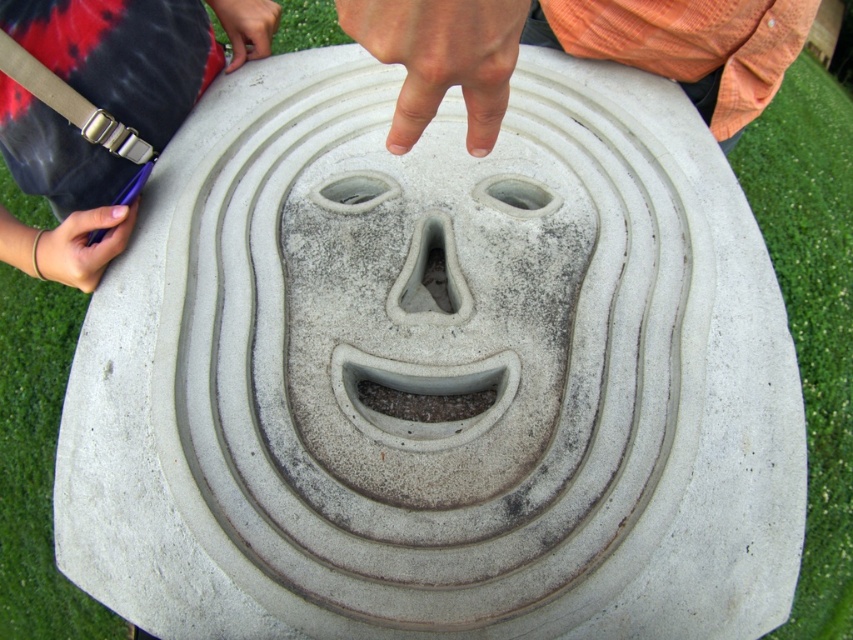
Can you confirm if tie-dye fabric at left is positioned above matte black hand at lower left?

Indeed, tie-dye fabric at left is positioned over matte black hand at lower left.

Does tie-dye fabric at left have a lesser height compared to matte black hand at lower left?

No.

Is point (93, 12) farther from viewer compared to point (61, 221)?

Yes, point (93, 12) is farther from viewer.

Locate an element on the screen. The image size is (853, 640). tie-dye fabric at left is located at coordinates (122, 56).

Is white matte finger at center shorter than matte black hand at lower left?

Correct, white matte finger at center is not as tall as matte black hand at lower left.

Can you confirm if white matte finger at center is bigger than matte black hand at lower left?

Indeed, white matte finger at center has a larger size compared to matte black hand at lower left.

Does point (473, 124) come behind point (108, 248)?

No, it is not.

Locate an element on the screen. white matte finger at center is located at coordinates (440, 58).

The width and height of the screenshot is (853, 640). Identify the location of matte black hand at lower left. (x=78, y=246).

Does matte black hand at lower left have a lesser width compared to matte black hand at upper center?

Incorrect, matte black hand at lower left's width is not less than matte black hand at upper center's.

Is point (67, 278) closer to camera compared to point (262, 49)?

Yes, point (67, 278) is in front of point (262, 49).

Locate an element on the screen. matte black hand at lower left is located at coordinates (78, 246).